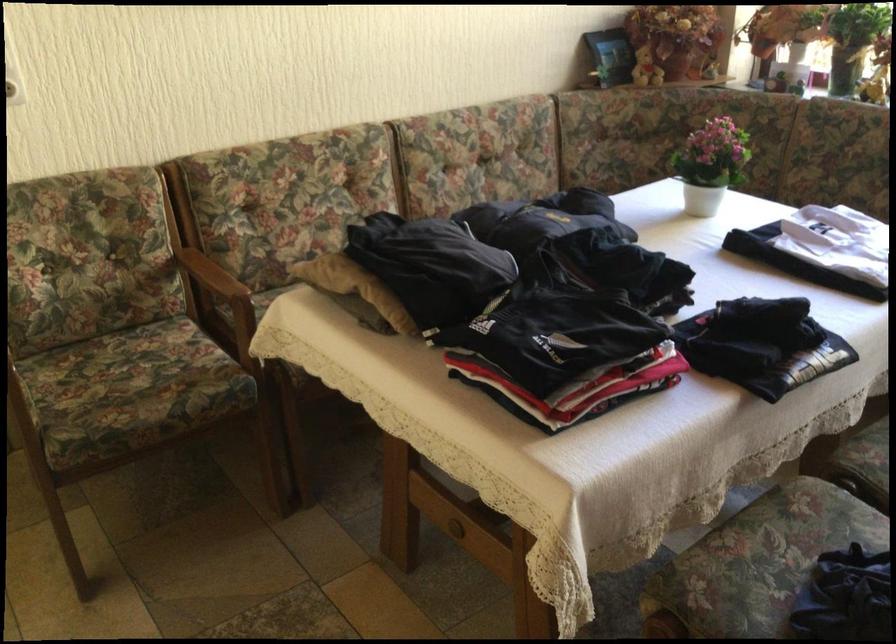
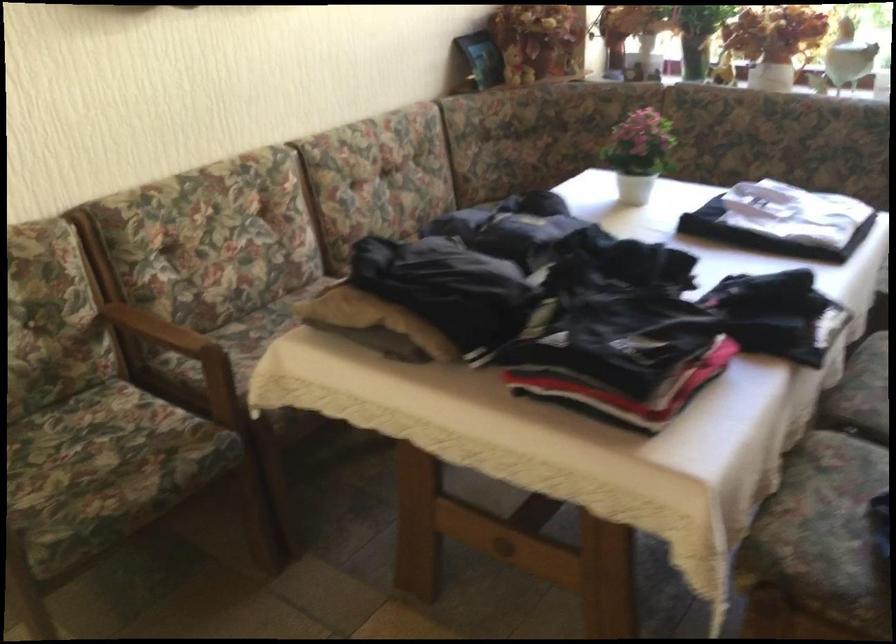
Locate, in the second image, the point that corresponds to (703,165) in the first image.

(639, 153)